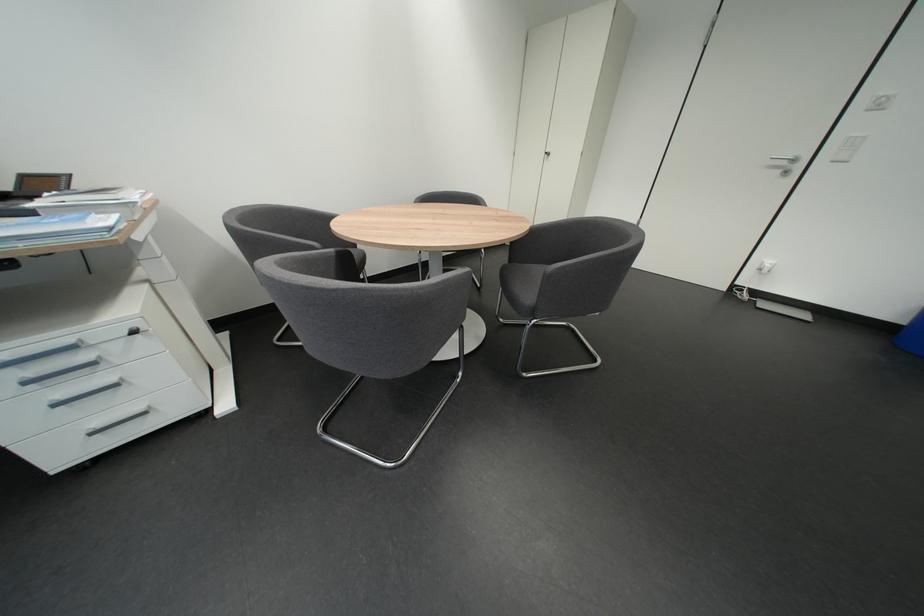
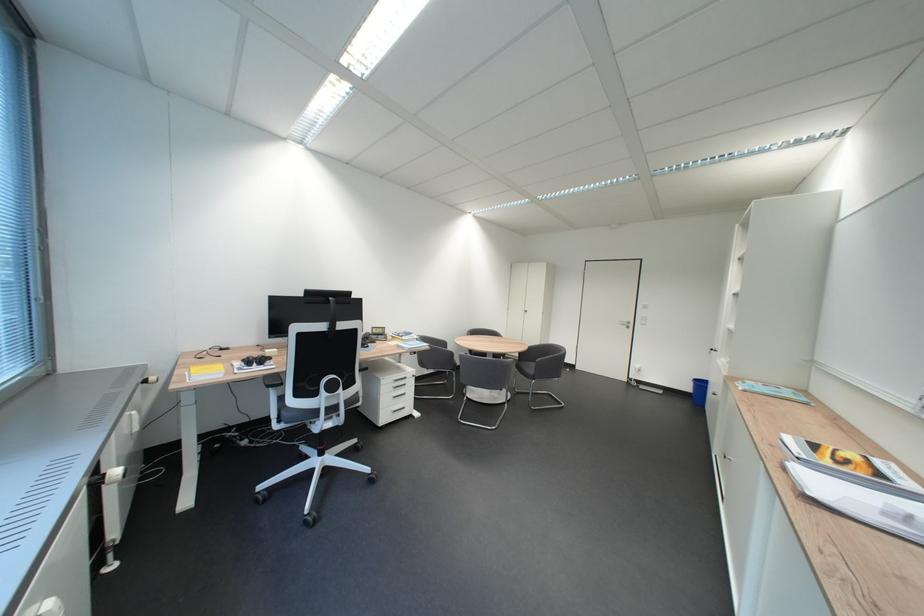
What movement of the cameraman would produce the second image?

The cameraman moved toward left, backward.